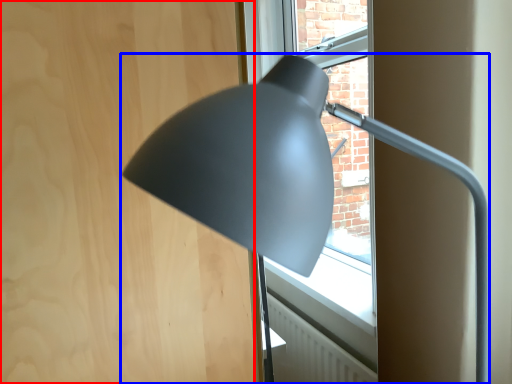
Question: Which point is further to the camera, plywood (highlighted by a red box) or lamp (highlighted by a blue box)?

Choices:
 (A) plywood
 (B) lamp

Answer: (A)